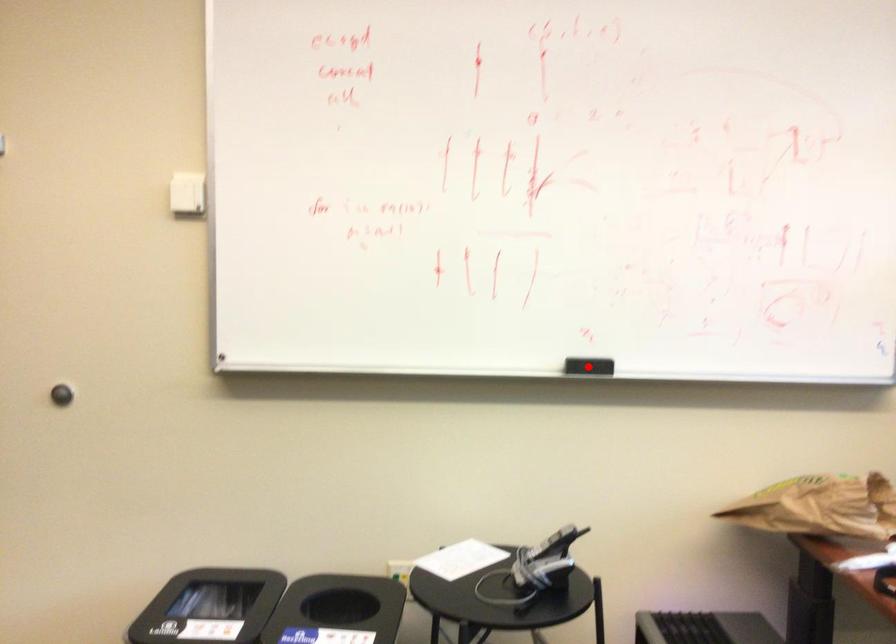
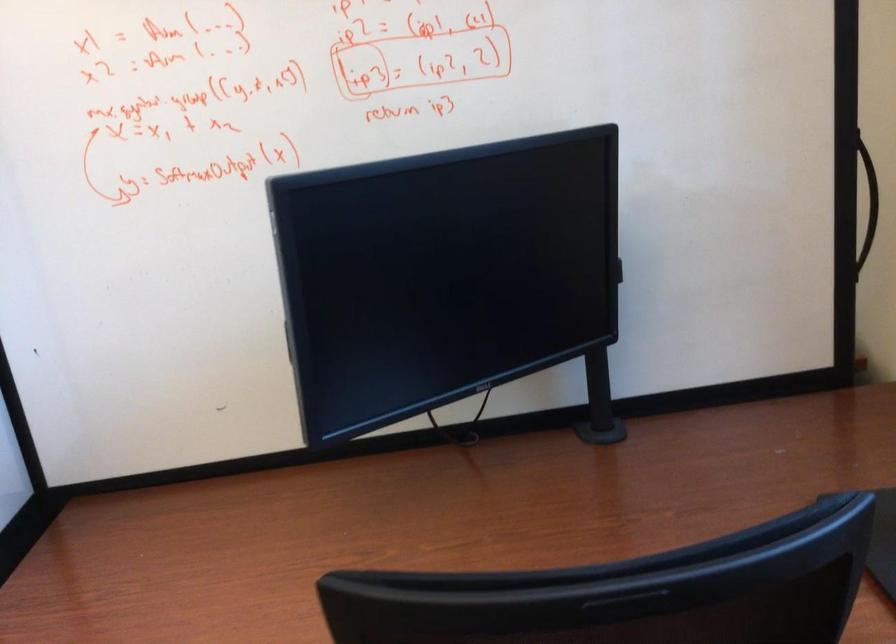
Question: I am providing you with two images of the same scene from different viewpoints. A red point is marked on the first image. Is the red point's position out of view in image 2?

Choices:
 (A) Yes
 (B) No

Answer: (A)